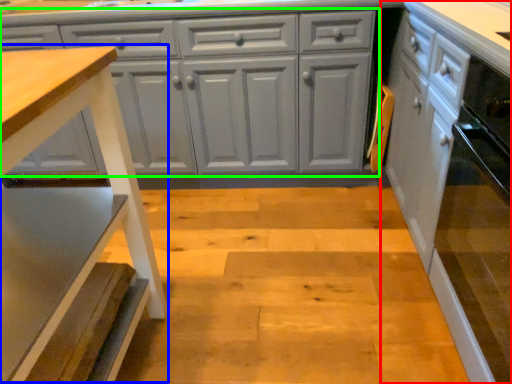
Question: Based on their relative distances, which object is nearer to cabinetry (highlighted by a red box)? Choose from step stool (highlighted by a blue box) and cabinetry (highlighted by a green box).

Choices:
 (A) step stool
 (B) cabinetry

Answer: (B)